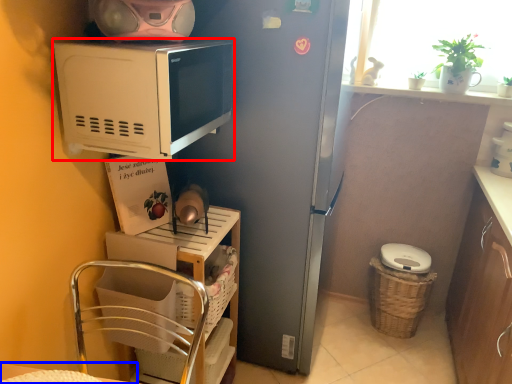
Question: Which of the following is the closest to the observer, microwave oven (highlighted by a red box) or table (highlighted by a blue box)?

Choices:
 (A) microwave oven
 (B) table

Answer: (B)